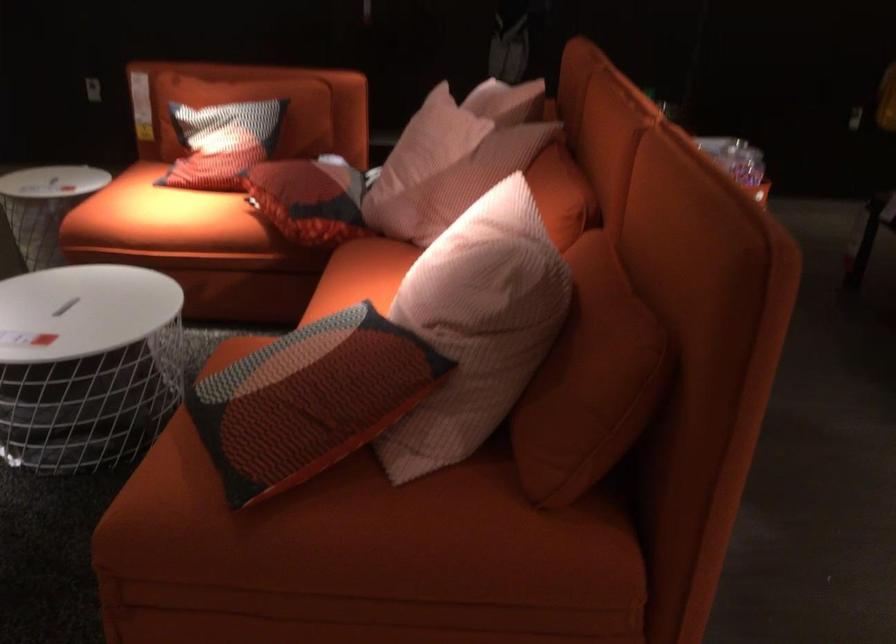
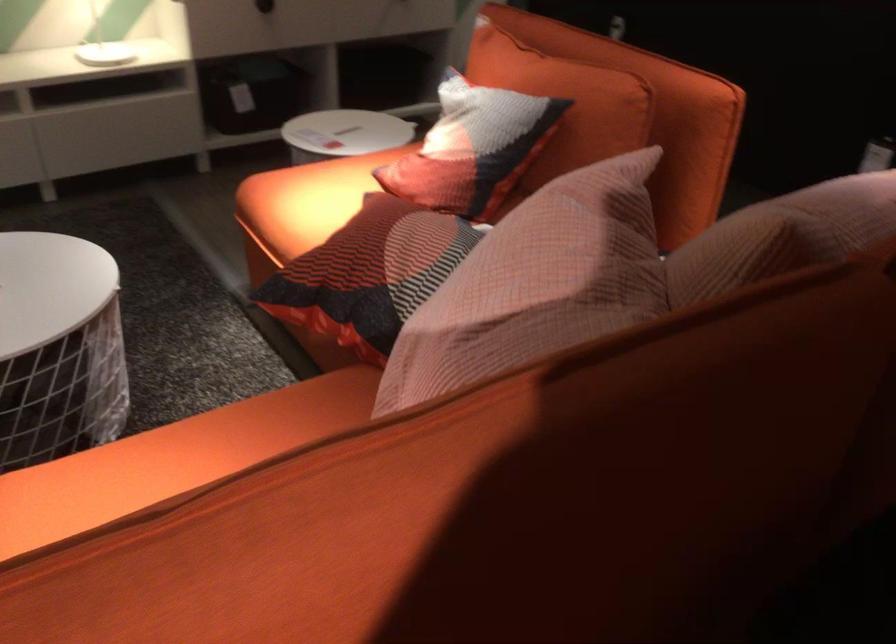
Find the pixel in the second image that matches (x=214, y=301) in the first image.

(322, 348)